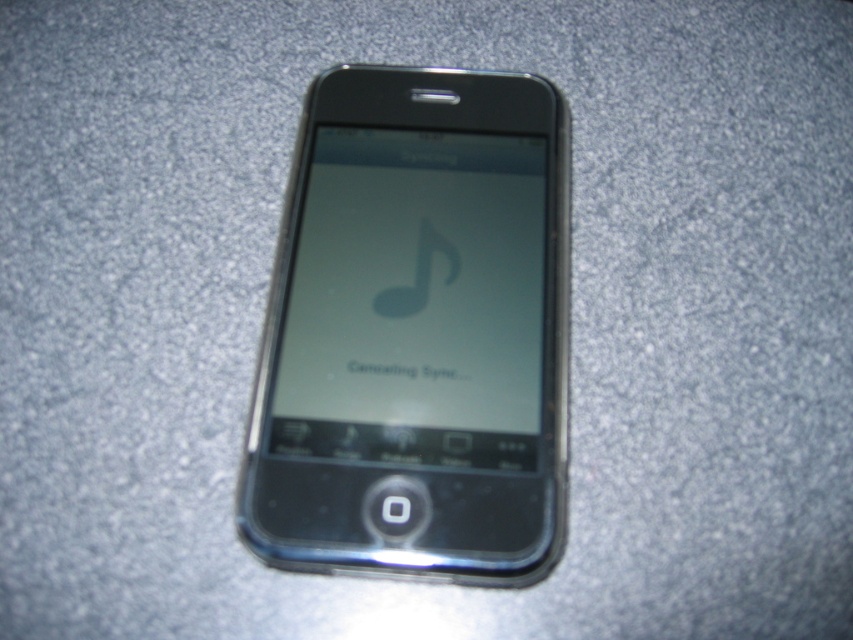
Is black glossy smartphone at center to the right of matte glass screen at center from the viewer's perspective?

Correct, you'll find black glossy smartphone at center to the right of matte glass screen at center.

Is black glossy smartphone at center bigger than matte glass screen at center?

Yes.

Which is behind, point (445, 561) or point (410, 312)?

Positioned behind is point (410, 312).

The image size is (853, 640). Identify the location of black glossy smartphone at center. (416, 333).